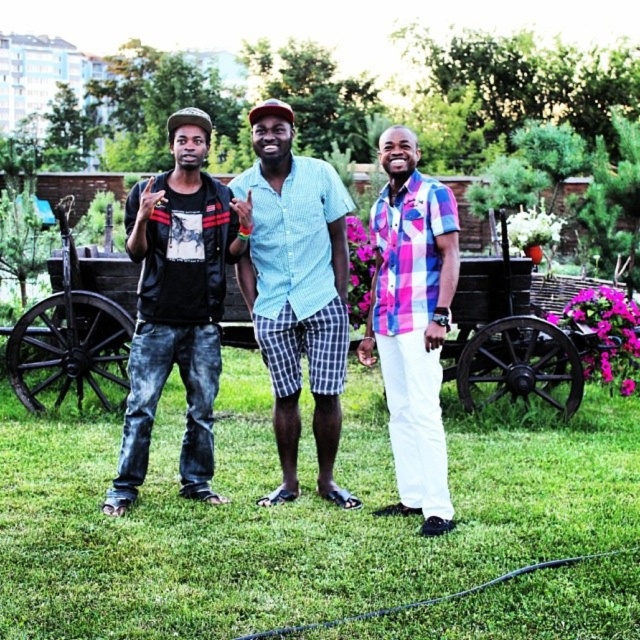
Which of these two, green grass at center or wooden wagon at center, stands taller?

wooden wagon at center

Is green grass at center below wooden wagon at center?

Yes.

Where is `green grass at center`? The height and width of the screenshot is (640, 640). green grass at center is located at coordinates (291, 513).

Looking at this image, between wooden wagon at center and pink plaid shirt at center, which one is positioned higher?

Positioned higher is wooden wagon at center.

Find the location of a particular element. The image size is (640, 640). wooden wagon at center is located at coordinates (515, 340).

Is wooden wagon at center taller than light blue checkered shorts at center?

Yes, wooden wagon at center is taller than light blue checkered shorts at center.

Between wooden wagon at center and light blue checkered shorts at center, which one has less height?

light blue checkered shorts at center

Is point (29, 385) farther from camera compared to point (260, 109)?

Yes, it is.

At what (x,y) coordinates should I click in order to perform the action: click on wooden wagon at center. Please return your answer as a coordinate pair (x, y). The width and height of the screenshot is (640, 640). Looking at the image, I should click on (515, 340).